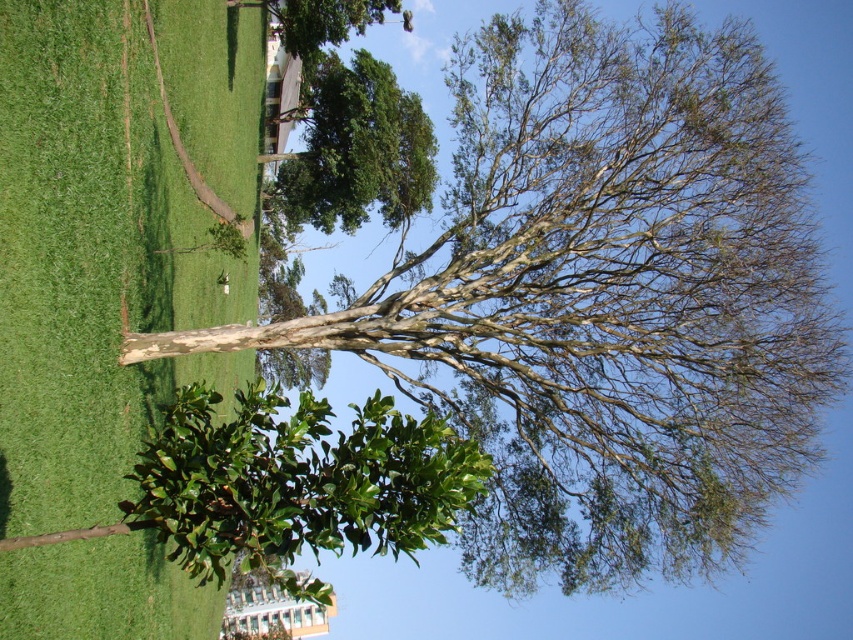
You are a gardener who needs to water both the green leafy bush at lower left and the green leafy tree at upper center. Your hose can reach up to 20 meters. Starting from the bush, can you water the tree without moving the hose nozzle?

The distance between the green leafy bush at lower left and the green leafy tree at upper center is 22.68 meters. Since the hose can only reach up to 20 meters, you cannot water the tree without moving the hose nozzle.